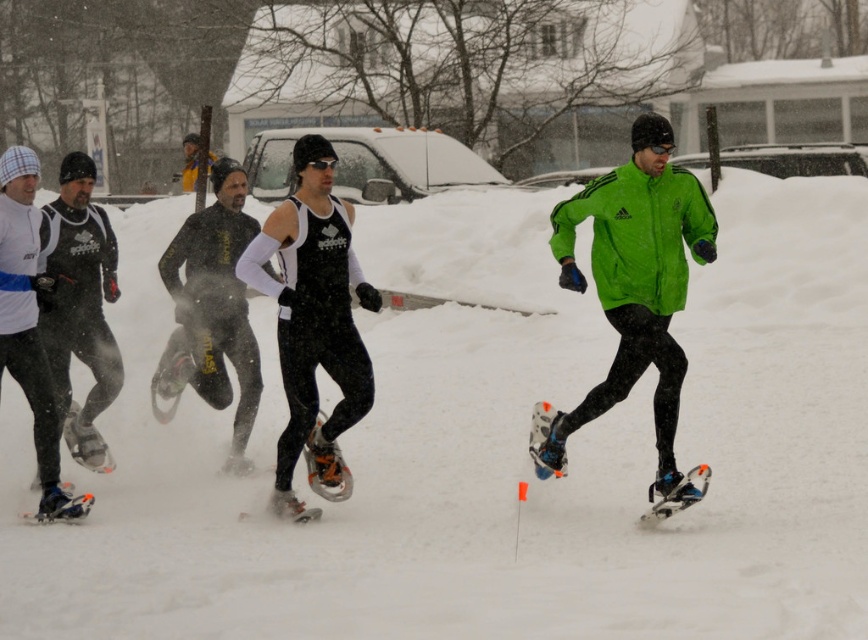
You are a photographer standing at the origin point of the coordinate system. You want to take a photo of the matte black snowshoes at left. What are the coordinates of the snowshoes?

The coordinates of the matte black snowshoes at left are at point (79, 305).

You are a snowshoeing participant standing on the white fluffy snow at center. Your snowshoes are the black matte snowshoes at center. Can you feel the snow underneath your snowshoes?

The white fluffy snow at center has a greater height compared to the black matte snowshoes at center, meaning the snow is deeper than the snowshoes. Since the snow is deeper, your snowshoes will sink into the snow, allowing you to feel the snow underneath your snowshoes.

You are a participant in the snowshoeing event. You notice the white fluffy snow at center and the black matte snowshoes at center. Which object is wider?

The white fluffy snow at center might be wider than black matte snowshoes at center.